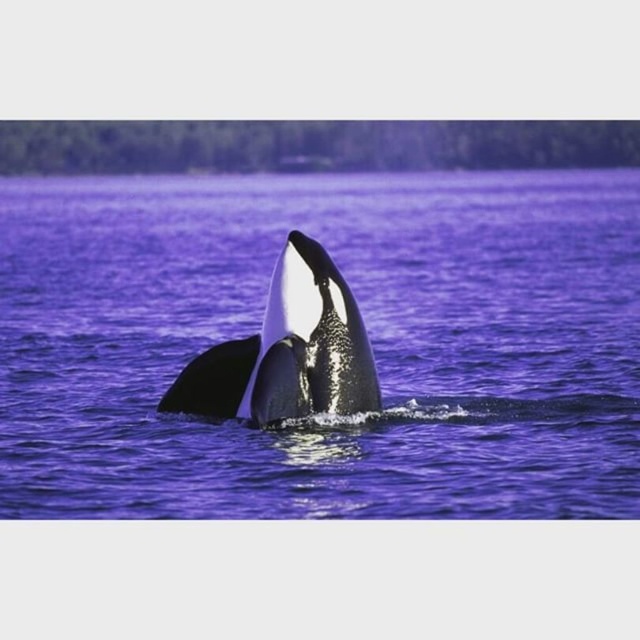
Who is positioned more to the left, purple water at center or black smooth whale at center?

black smooth whale at center is more to the left.

You are a GUI agent. You are given a task and a screenshot of the screen. Output one action in this format:
    pyautogui.click(x=<x>, y=<y>)
    Task: Click on the purple water at center
    This screenshot has width=640, height=640.
    Given the screenshot: What is the action you would take?
    pyautogui.click(x=369, y=333)